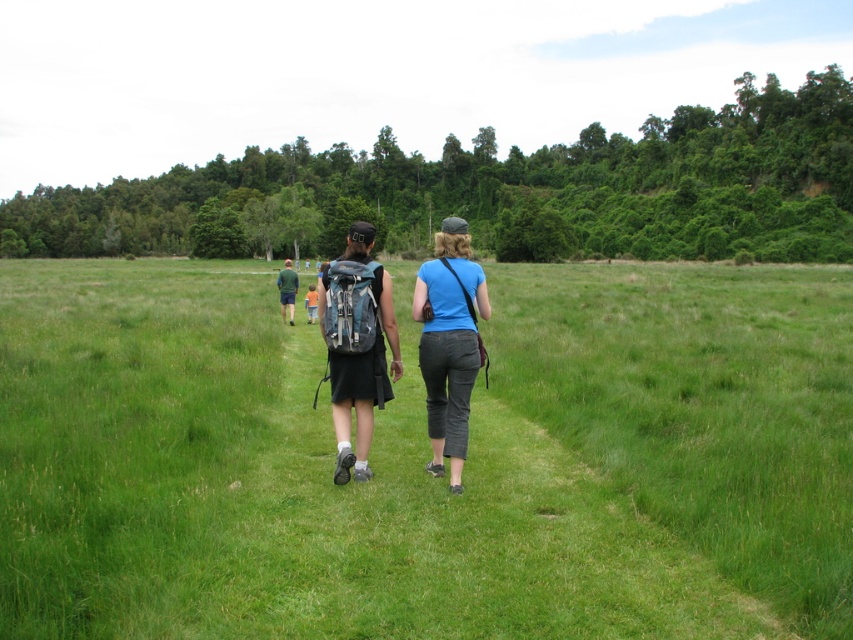
Question: Which of the following is the farthest from the observer?

Choices:
 (A) matte gray backpack at center
 (B) green grass at center

Answer: (A)

Question: Which point appears farthest from the camera in this image?

Choices:
 (A) (280, 294)
 (B) (444, 380)
 (C) (445, 422)
 (D) (80, 508)

Answer: (A)

Question: Is green grass at center to the left of matte gray backpack at center from the viewer's perspective?

Choices:
 (A) no
 (B) yes

Answer: (B)

Question: Can you confirm if blue cotton shirt at center is thinner than green fabric shirt at center?

Choices:
 (A) yes
 (B) no

Answer: (A)

Question: Which is farther from the green fabric shirt at center?

Choices:
 (A) blue cotton shirt at center
 (B) green grass at center
 (C) matte gray backpack at center

Answer: (A)

Question: Is green grass at center smaller than blue cotton shirt at center?

Choices:
 (A) yes
 (B) no

Answer: (B)